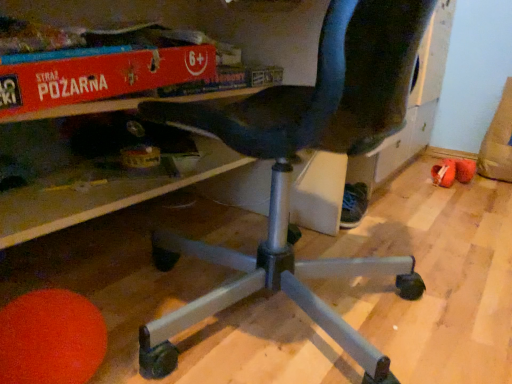
Where is `vacant space that is in between black plastic chair at center and brown suede bean bag at lower right`? The width and height of the screenshot is (512, 384). vacant space that is in between black plastic chair at center and brown suede bean bag at lower right is located at coordinates (426, 226).